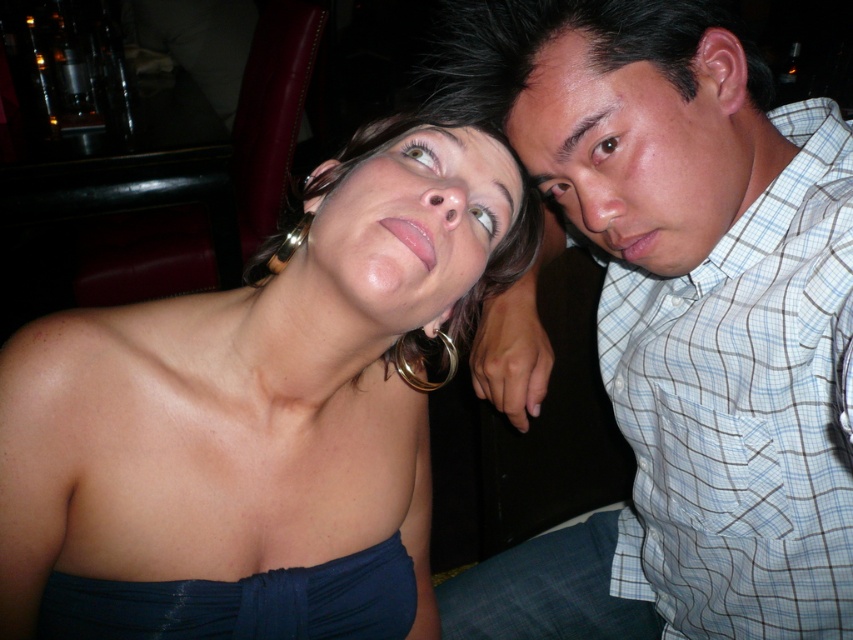
Question: Can you confirm if shiny blue dress at center is thinner than matte plaid shirt at upper right?

Choices:
 (A) yes
 (B) no

Answer: (B)

Question: From the image, what is the correct spatial relationship of shiny blue dress at center in relation to matte plaid shirt at upper right?

Choices:
 (A) left
 (B) right

Answer: (A)

Question: Among these points, which one is farthest from the camera?

Choices:
 (A) (605, 99)
 (B) (357, 154)
 (C) (157, 440)
 (D) (701, 413)

Answer: (D)

Question: Estimate the real-world distances between objects in this image. Which object is closer to the matte skin face at upper center?

Choices:
 (A) blue plaid shirt at upper right
 (B) shiny blue dress at center
 (C) matte plaid shirt at upper right

Answer: (C)

Question: Which point appears farthest from the camera in this image?

Choices:
 (A) (74, 360)
 (B) (766, 596)
 (C) (645, 76)
 (D) (350, 140)

Answer: (D)

Question: Where is matte plaid shirt at upper right located in relation to matte skin face at upper center in the image?

Choices:
 (A) right
 (B) left

Answer: (A)